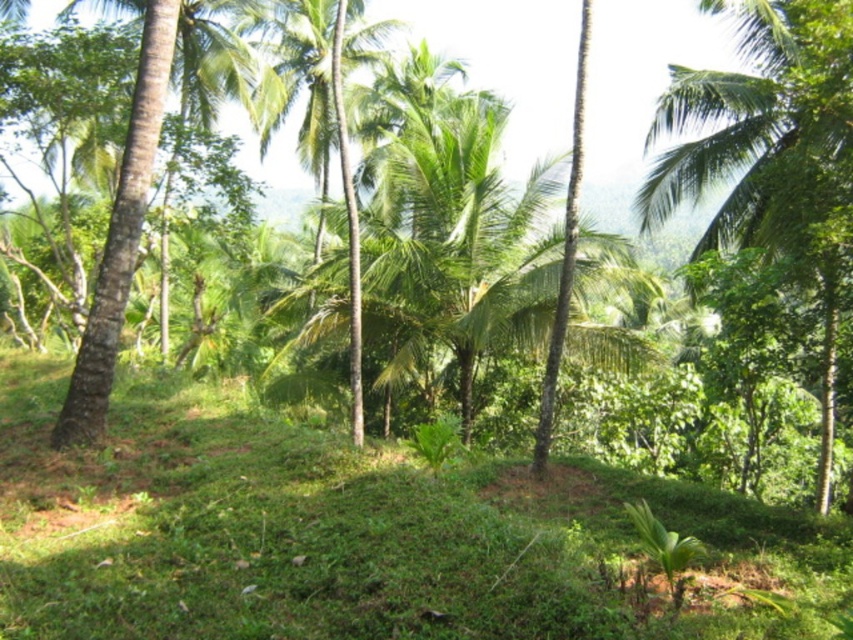
Does point (831, 170) lie behind point (316, 84)?

No, (831, 170) is closer to viewer.

Is green leafy palm tree at upper right to the left of green leafy palm tree at center from the viewer's perspective?

Incorrect, green leafy palm tree at upper right is not on the left side of green leafy palm tree at center.

Is point (793, 0) farther from viewer compared to point (352, 192)?

That is True.

Find the location of a particular element. green leafy palm tree at upper right is located at coordinates (772, 157).